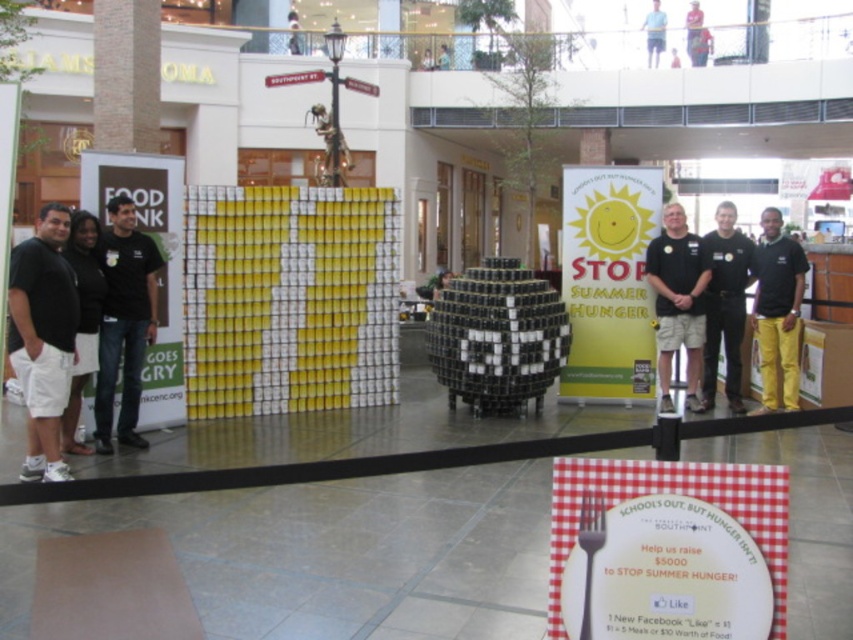
Question: Among these objects, which one is nearest to the camera?

Choices:
 (A) black t-shirt at left
 (B) black cotton shirt at left
 (C) black cotton shirt at center

Answer: (B)

Question: Among these points, which one is farthest from the camera?

Choices:
 (A) (585, 492)
 (B) (109, 323)
 (C) (61, 474)
 (D) (740, 257)

Answer: (D)

Question: Does black cotton shirt at center have a smaller size compared to yellow matte pants at right?

Choices:
 (A) no
 (B) yes

Answer: (B)

Question: Can you confirm if black cotton shirt at left is positioned below black shirt at right?

Choices:
 (A) no
 (B) yes

Answer: (B)

Question: Which of the following is the farthest from the observer?

Choices:
 (A) black cotton shirt at center
 (B) black cotton shirt at left
 (C) black t-shirt at left
 (D) black shirt at right

Answer: (A)

Question: Is black cotton shirt at left closer to the viewer compared to yellow matte pants at right?

Choices:
 (A) yes
 (B) no

Answer: (A)